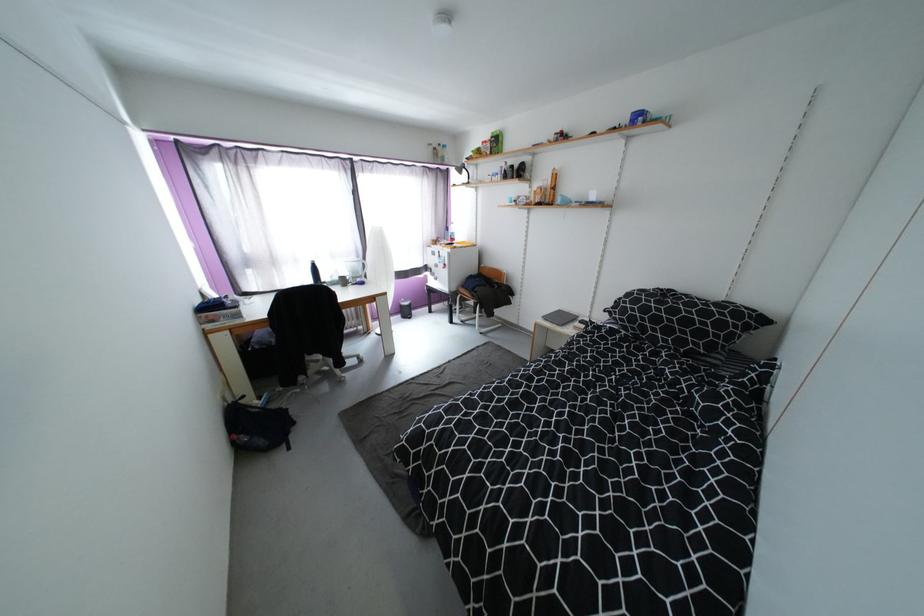
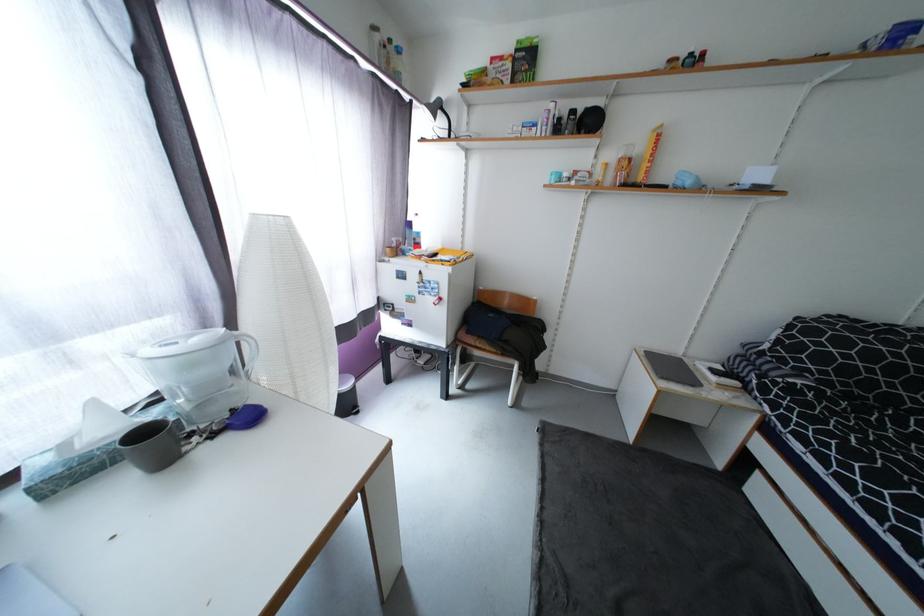
The point at (565, 312) is marked in the first image. Where is the corresponding point in the second image?

(650, 353)